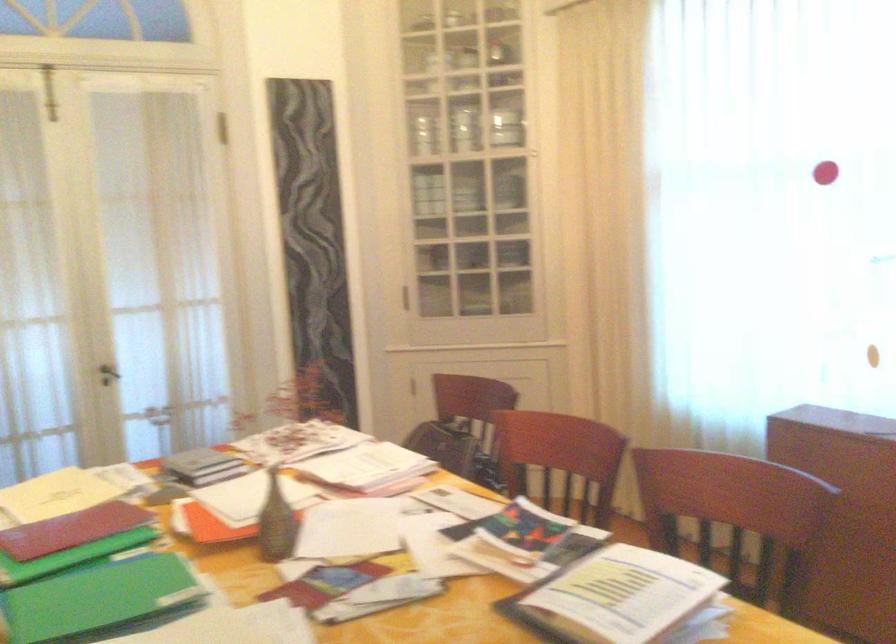
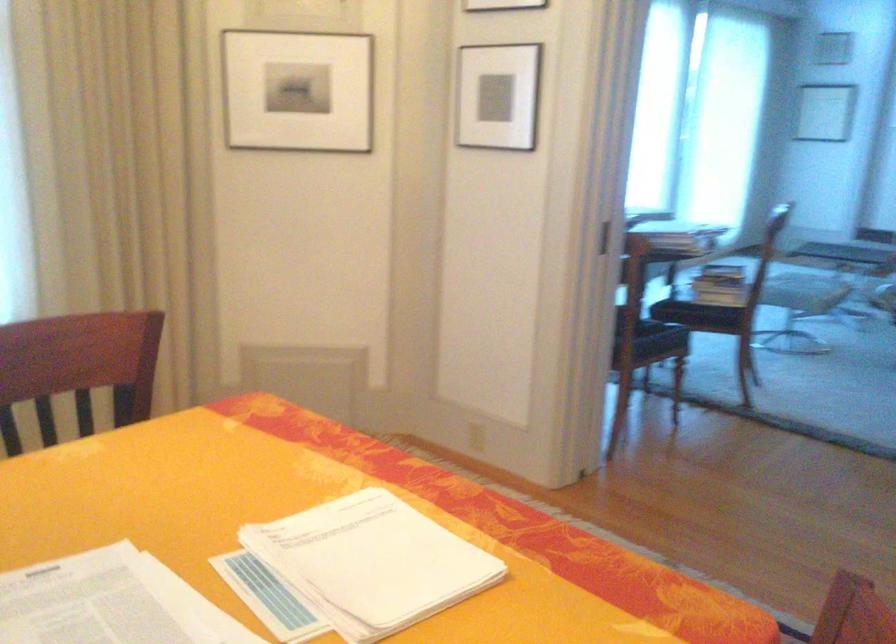
Question: Based on the continuous images, in which direction is the camera rotating? Reply with the corresponding letter.

Choices:
 (A) Left
 (B) Right
 (C) Up
 (D) Down

Answer: (B)